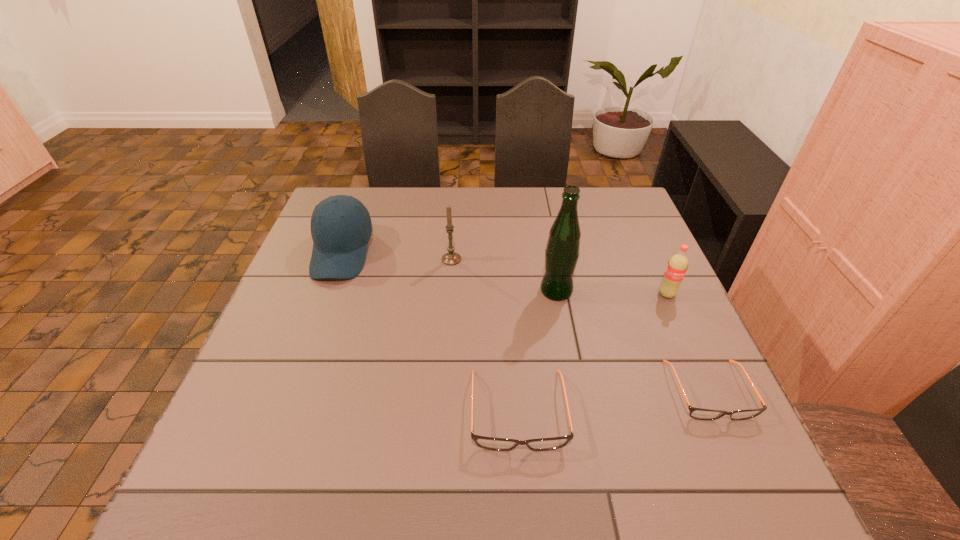
The height and width of the screenshot is (540, 960). I want to click on the taller spectacles, so click(x=497, y=444).

Identify the location of the fifth tallest object. This screenshot has height=540, width=960. (497, 444).

At what (x,y) coordinates should I click in order to perform the action: click on the right spectacles. Please return your answer as a coordinate pair (x, y). The height and width of the screenshot is (540, 960). Looking at the image, I should click on (702, 414).

At what (x,y) coordinates should I click in order to perform the action: click on the shortest object. Please return your answer as a coordinate pair (x, y). Looking at the image, I should click on (702, 414).

Find the location of a particular element. soda is located at coordinates (677, 266).

The width and height of the screenshot is (960, 540). Find the location of `the leftmost object`. the leftmost object is located at coordinates (341, 227).

The height and width of the screenshot is (540, 960). I want to click on the second object from left to right, so click(451, 258).

What are the coordinates of `the tallest object` in the screenshot? It's located at (x=562, y=251).

You are a GUI agent. You are given a task and a screenshot of the screen. Output one action in this format:
    pyautogui.click(x=<x>, y=<y>)
    Task: Click on the vacant space situated 0.090m on the back of the soda
    The image size is (960, 540).
    Given the screenshot: What is the action you would take?
    pyautogui.click(x=654, y=266)

Identify the location of free region located 0.100m on the front-facing side of the baseball cap. This screenshot has width=960, height=540. (321, 313).